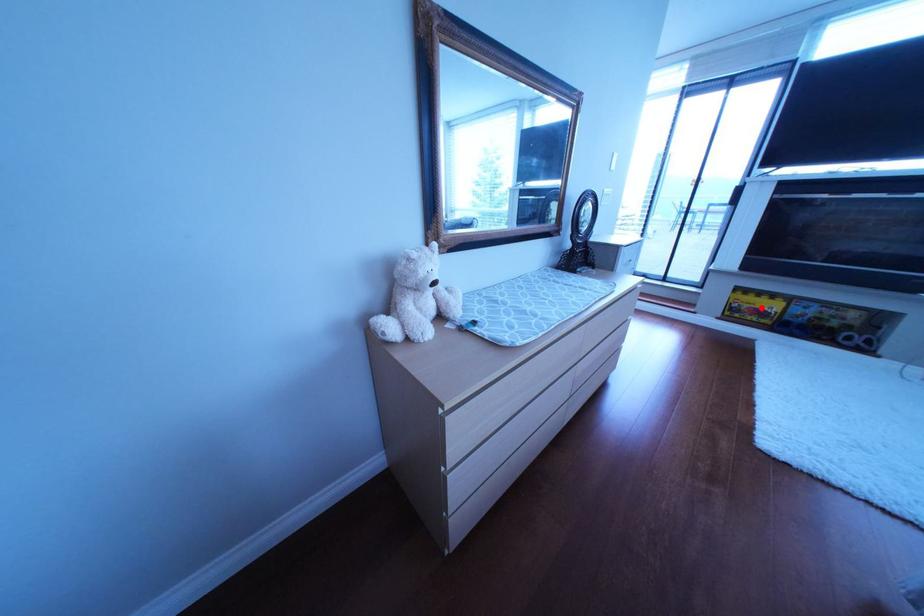
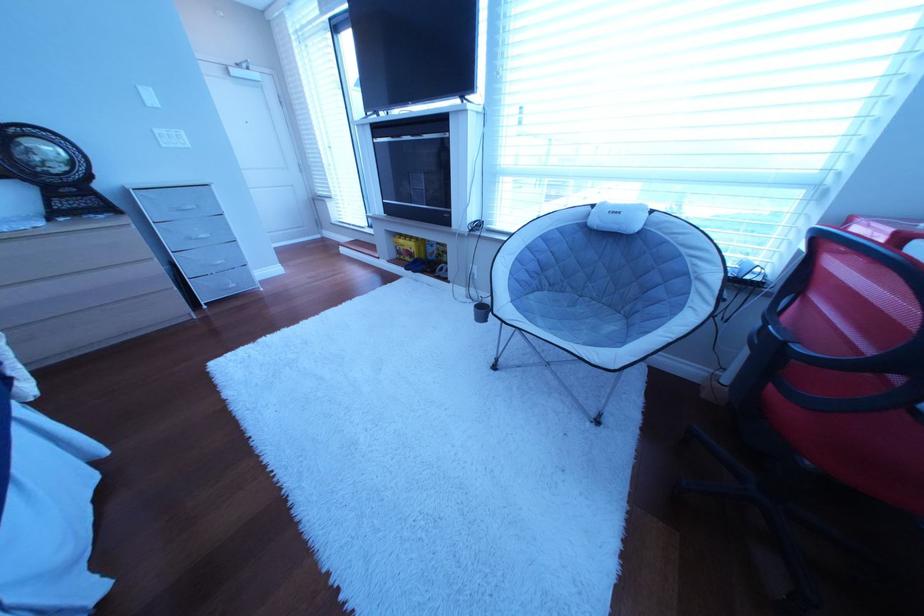
Question: I am providing you with two images of the same scene from different viewpoints. In image1, a red point is highlighted. Considering the same 3D point in image2, which of the following is correct?

Choices:
 (A) It is closer
 (B) It is farther

Answer: (A)